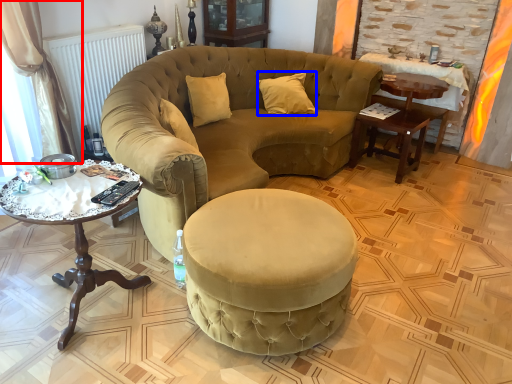
Question: Which object is closer to the camera taking this photo, curtain (highlighted by a red box) or pillow (highlighted by a blue box)?

Choices:
 (A) curtain
 (B) pillow

Answer: (A)